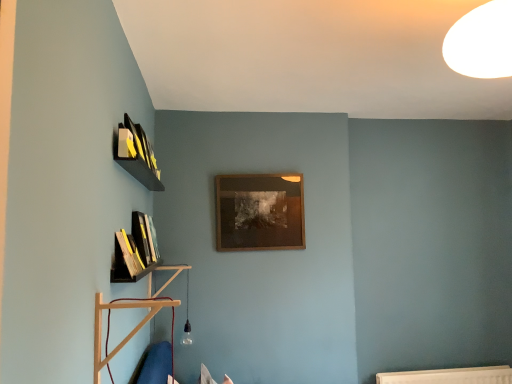
Question: Can you confirm if wooden book at lower left, which is the 2th book from back to front, is shorter than wooden shelf at lower left, which is counted as the second shelf, starting from the back?

Choices:
 (A) yes
 (B) no

Answer: (A)

Question: Is wooden book at lower left, which is counted as the 1th book, starting from the front, to the right of wooden shelf at lower left, which is counted as the second shelf, starting from the back, from the viewer's perspective?

Choices:
 (A) no
 (B) yes

Answer: (A)

Question: Is wooden shelf at lower left, which ranks as the first shelf in front-to-back order, a part of wooden book at lower left, which is counted as the 1th book, starting from the front?

Choices:
 (A) yes
 (B) no

Answer: (B)

Question: Does wooden book at lower left, which is counted as the 1th book, starting from the front, lie behind wooden shelf at lower left, which is counted as the second shelf, starting from the back?

Choices:
 (A) no
 (B) yes

Answer: (B)

Question: Does wooden book at lower left, which is the 2th book from back to front, turn towards wooden shelf at lower left, which is counted as the second shelf, starting from the back?

Choices:
 (A) yes
 (B) no

Answer: (B)

Question: Does wooden book at lower left, which is counted as the 1th book, starting from the front, have a greater width compared to wooden shelf at lower left, which ranks as the first shelf in front-to-back order?

Choices:
 (A) yes
 (B) no

Answer: (B)

Question: From the image's perspective, is wooden shelf at lower left, which is counted as the second shelf, starting from the back, beneath wooden picture frame at center?

Choices:
 (A) yes
 (B) no

Answer: (A)

Question: Considering the relative sizes of wooden shelf at lower left, which is counted as the second shelf, starting from the back, and wooden picture frame at center in the image provided, is wooden shelf at lower left, which is counted as the second shelf, starting from the back, smaller than wooden picture frame at center?

Choices:
 (A) no
 (B) yes

Answer: (B)

Question: Considering the relative sizes of wooden shelf at lower left, which ranks as the first shelf in front-to-back order, and wooden picture frame at center in the image provided, is wooden shelf at lower left, which ranks as the first shelf in front-to-back order, wider than wooden picture frame at center?

Choices:
 (A) yes
 (B) no

Answer: (A)

Question: Considering the relative sizes of wooden shelf at lower left, which is counted as the second shelf, starting from the back, and wooden picture frame at center in the image provided, is wooden shelf at lower left, which is counted as the second shelf, starting from the back, taller than wooden picture frame at center?

Choices:
 (A) yes
 (B) no

Answer: (B)

Question: Is the depth of wooden shelf at lower left, which ranks as the first shelf in front-to-back order, less than that of wooden picture frame at center?

Choices:
 (A) no
 (B) yes

Answer: (B)

Question: Is there a large distance between wooden shelf at lower left, which ranks as the first shelf in front-to-back order, and wooden picture frame at center?

Choices:
 (A) no
 (B) yes

Answer: (A)

Question: Could you tell me if hardcover book at left, marked as the first book in a back-to-front arrangement, is facing wooden book at lower left, which is counted as the 1th book, starting from the front?

Choices:
 (A) yes
 (B) no

Answer: (B)